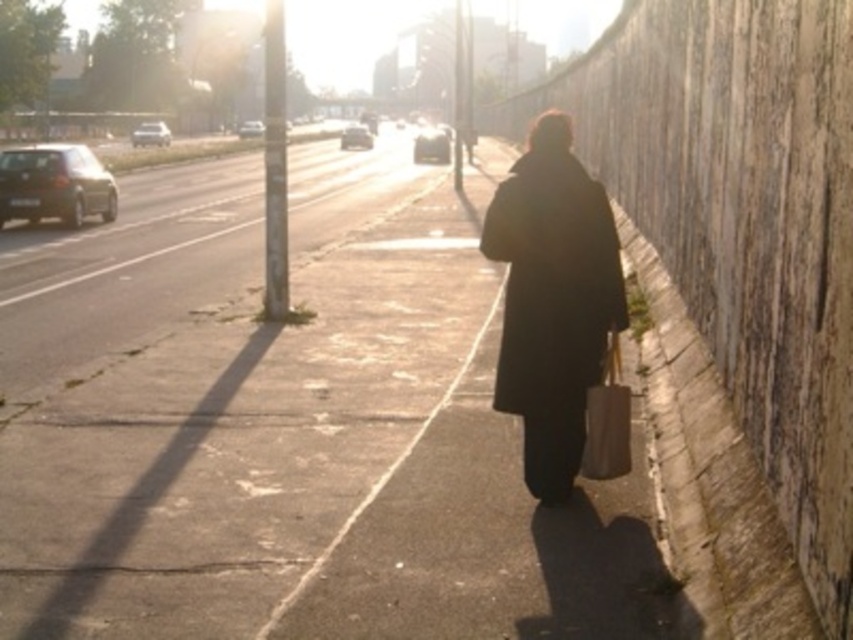
Consider the image. You are standing on the sidewalk and see the matte beige shopping bag at right and the metallic silver car at upper left. Which object is taller?

The metallic silver car at upper left is taller than the matte beige shopping bag at right.

You are a delivery person needing to park your vehicle between the shiny black sedan at left and the shiny silver car at center. Can your 1.8 meter wide delivery van fit in the space between them?

The shiny black sedan at left has a lesser width compared to shiny silver car at center. Therefore, the space between them is wider than 1.8 meters, so the delivery van can fit.

You are a delivery driver who needs to park your shiny silver sedan at left and shiny silver sedan at center in a narrow alley. Which one can fit better in the space?

The shiny silver sedan at left is thinner than the shiny silver sedan at center, so the shiny silver sedan at left can fit better in the narrow alley.